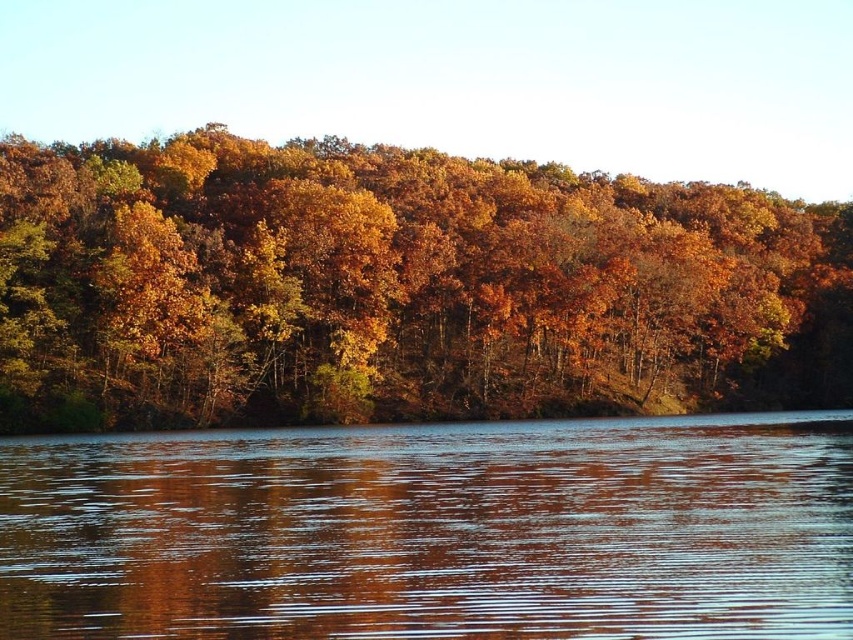
Does autumn leaves at center come behind glossy reflective water at center?

Yes.

Is autumn leaves at center above glossy reflective water at center?

Indeed, autumn leaves at center is positioned over glossy reflective water at center.

You are a GUI agent. You are given a task and a screenshot of the screen. Output one action in this format:
    pyautogui.click(x=<x>, y=<y>)
    Task: Click on the autumn leaves at center
    The height and width of the screenshot is (640, 853).
    Given the screenshot: What is the action you would take?
    coord(398,288)